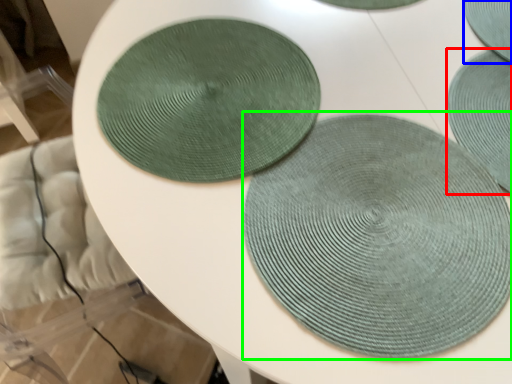
Question: Which is nearer to the mat (highlighted by a red box)? coaster (highlighted by a blue box) or mat (highlighted by a green box).

Choices:
 (A) coaster
 (B) mat

Answer: (A)